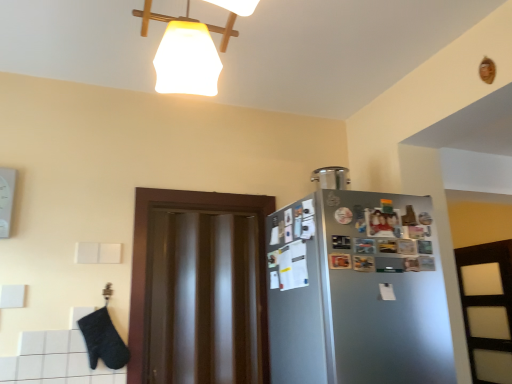
Question: Considering the positions of satin silver container at upper right and transparent glossy door at center in the image, is satin silver container at upper right taller or shorter than transparent glossy door at center?

Choices:
 (A) short
 (B) tall

Answer: (A)

Question: Would you say satin silver container at upper right is to the left or to the right of transparent glossy door at center in the picture?

Choices:
 (A) right
 (B) left

Answer: (A)

Question: Which object is positioned farthest from the transparent glossy door at center?

Choices:
 (A) satin silver container at upper right
 (B) satin silver fridge at right

Answer: (A)

Question: Estimate the real-world distances between objects in this image. Which object is closer to the transparent glossy door at center?

Choices:
 (A) satin silver container at upper right
 (B) satin silver fridge at right

Answer: (B)